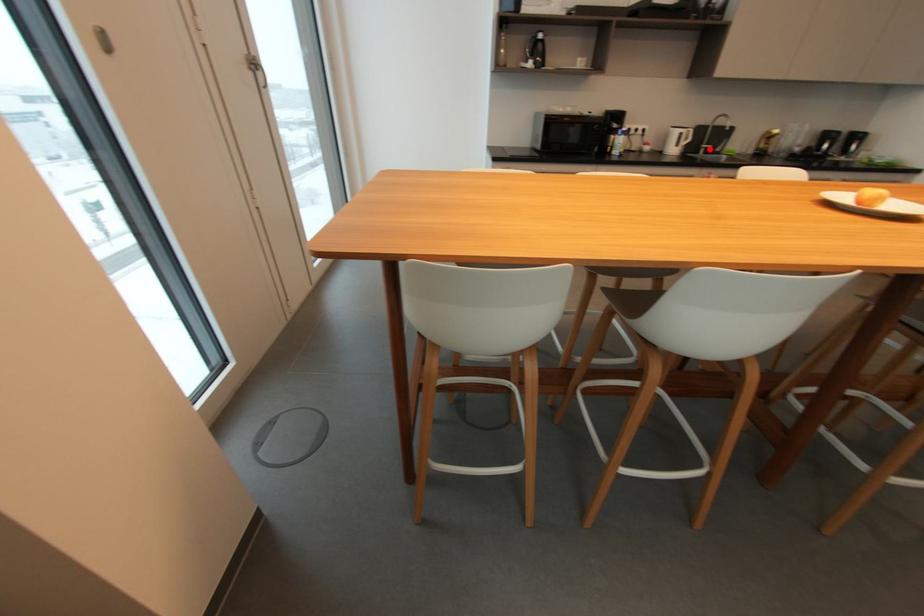
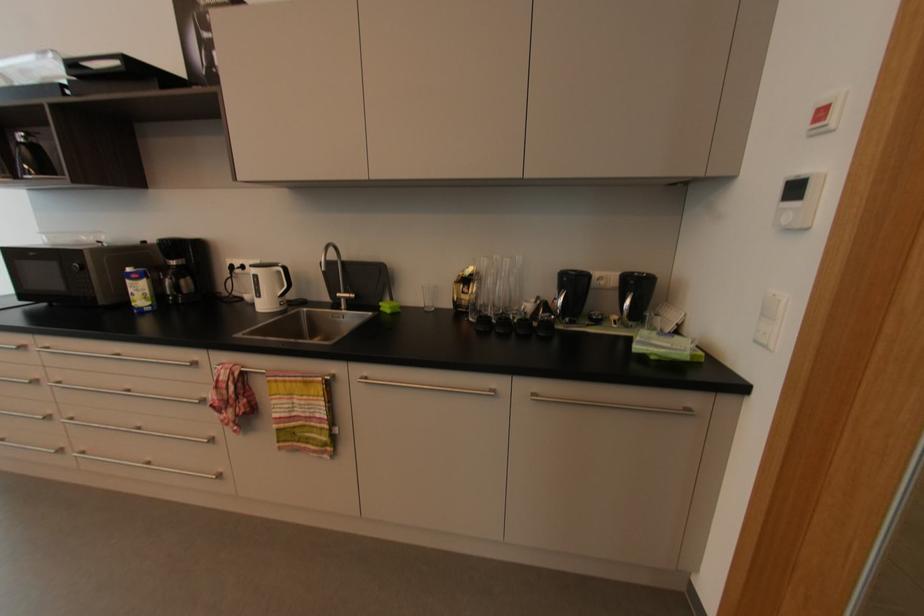
Locate, in the second image, the point that corresponds to the highlighted location in the first image.

(350, 300)